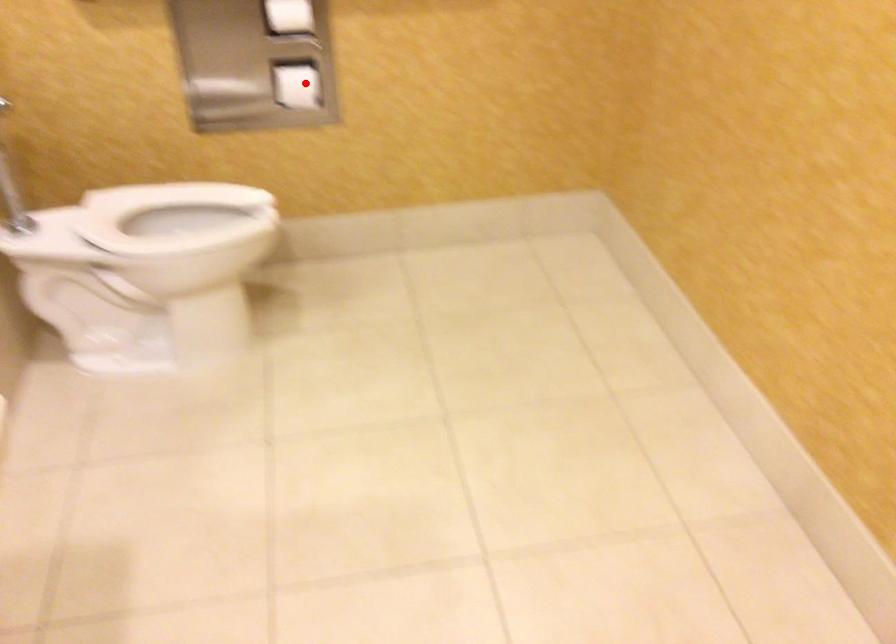
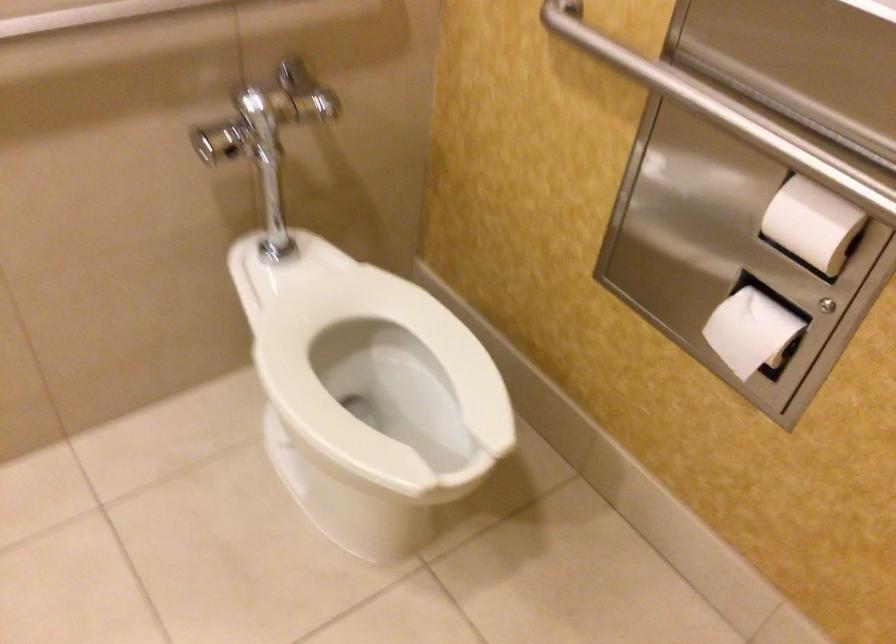
Locate, in the second image, the point that corresponds to the highlighted location in the first image.

(751, 330)